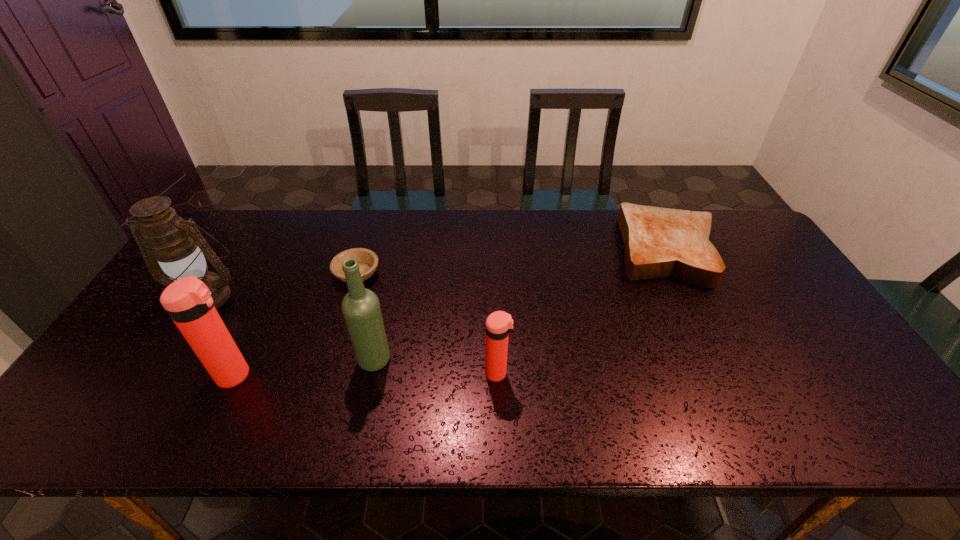
Considering the uniform spacing of thermos bottles, where should an additional thermos bottle be positioned on the right? Please locate a free spot. Please provide its 2D coordinates. Your answer should be formatted as a tuple, i.e. [(x, y)], where the tuple contains the x and y coordinates of a point satisfying the conditions above.

[(757, 371)]